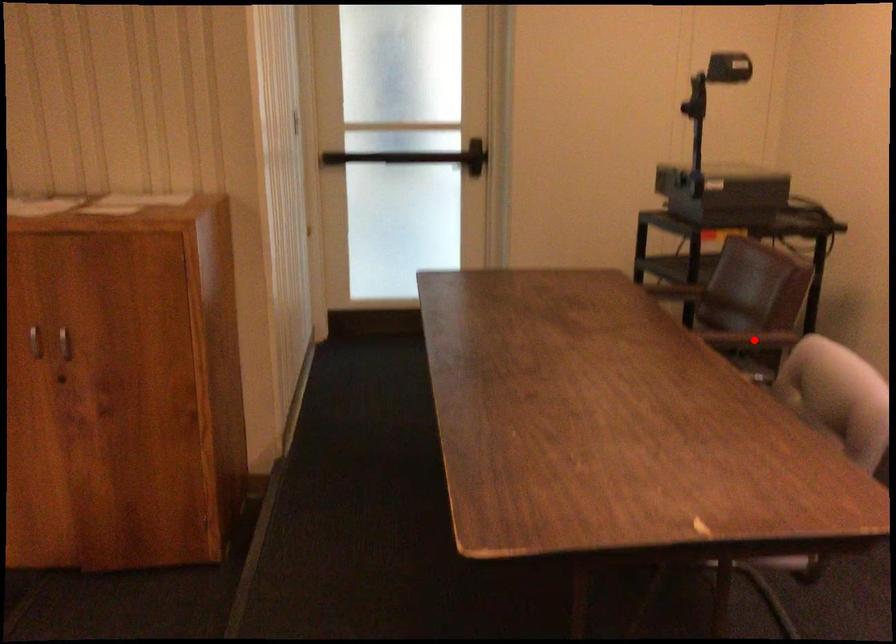
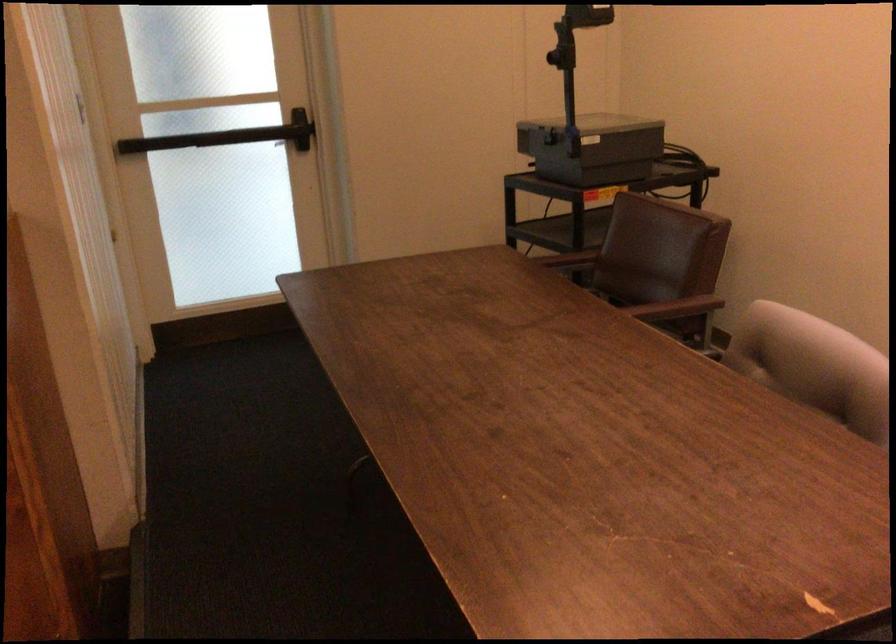
Question: I am providing you with two images of the same scene from different viewpoints. In image1, a red point is highlighted. Considering the same 3D point in image2, which of the following is correct?

Choices:
 (A) It is closer
 (B) It is farther

Answer: (A)